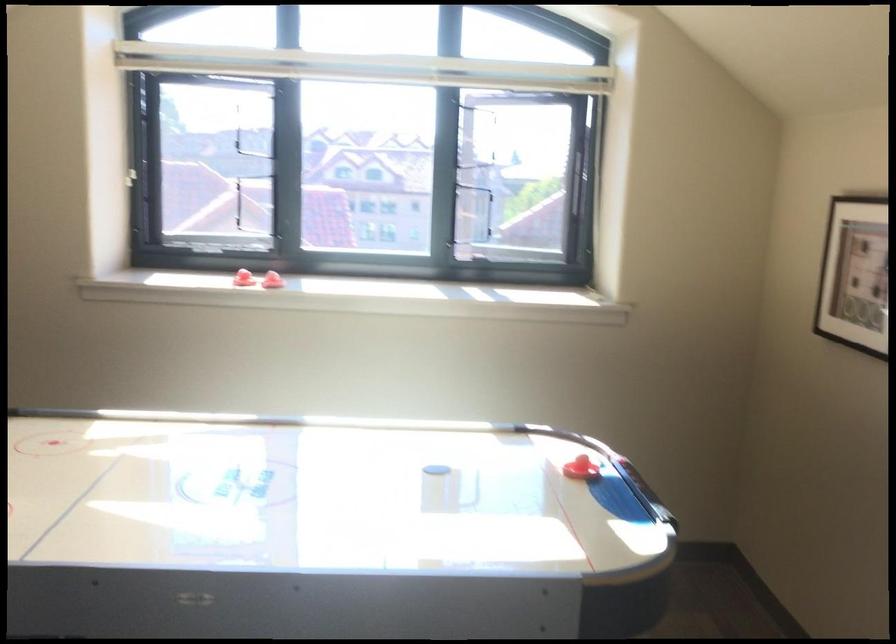
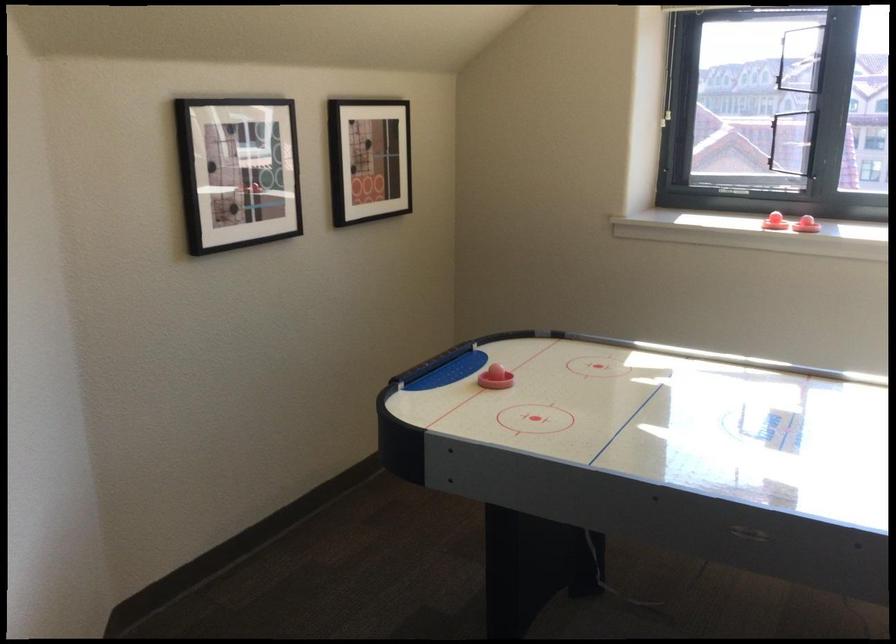
In the second image, find the point that corresponds to pixel 268 288 in the first image.

(806, 225)